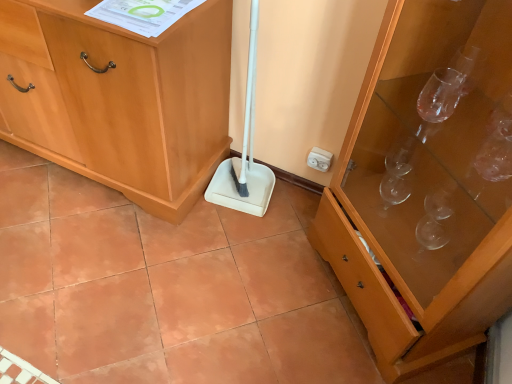
Question: Does light wood cabinet at center, placed as the 2th cabinetry when sorted from right to left, have a greater height compared to white plastic electric outlet at upper right?

Choices:
 (A) yes
 (B) no

Answer: (A)

Question: Considering the relative sizes of light wood cabinet at center, placed as the 2th cabinetry when sorted from right to left, and white plastic electric outlet at upper right in the image provided, is light wood cabinet at center, placed as the 2th cabinetry when sorted from right to left, thinner than white plastic electric outlet at upper right?

Choices:
 (A) no
 (B) yes

Answer: (A)

Question: Would you say light wood cabinet at center, placed as the 2th cabinetry when sorted from right to left, contains white plastic electric outlet at upper right?

Choices:
 (A) yes
 (B) no

Answer: (B)

Question: From the image's perspective, is light wood cabinet at center, placed as the 2th cabinetry when sorted from right to left, on top of white plastic electric outlet at upper right?

Choices:
 (A) yes
 (B) no

Answer: (A)

Question: Does light wood cabinet at center, placed as the first cabinetry when sorted from left to right, have a smaller size compared to white plastic electric outlet at upper right?

Choices:
 (A) no
 (B) yes

Answer: (A)

Question: Does light wood cabinet at center, placed as the 2th cabinetry when sorted from right to left, appear on the right side of white plastic electric outlet at upper right?

Choices:
 (A) no
 (B) yes

Answer: (A)

Question: Would you say terracotta ceramic tile at center is part of light wood cabinet at center, placed as the 2th cabinetry when sorted from right to left,'s contents?

Choices:
 (A) no
 (B) yes

Answer: (A)

Question: Considering the relative positions of light wood cabinet at center, placed as the 2th cabinetry when sorted from right to left, and terracotta ceramic tile at center in the image provided, is light wood cabinet at center, placed as the 2th cabinetry when sorted from right to left, to the right of terracotta ceramic tile at center from the viewer's perspective?

Choices:
 (A) yes
 (B) no

Answer: (B)

Question: Is light wood cabinet at center, placed as the first cabinetry when sorted from left to right, not inside terracotta ceramic tile at center?

Choices:
 (A) no
 (B) yes

Answer: (B)

Question: From a real-world perspective, is light wood cabinet at center, placed as the 2th cabinetry when sorted from right to left, positioned under terracotta ceramic tile at center based on gravity?

Choices:
 (A) yes
 (B) no

Answer: (B)

Question: Does light wood cabinet at center, placed as the first cabinetry when sorted from left to right, have a lesser width compared to terracotta ceramic tile at center?

Choices:
 (A) no
 (B) yes

Answer: (B)

Question: Can you confirm if light wood cabinet at center, placed as the first cabinetry when sorted from left to right, is wider than terracotta ceramic tile at center?

Choices:
 (A) yes
 (B) no

Answer: (B)

Question: Considering the relative sizes of light wood cabinet at center, placed as the 2th cabinetry when sorted from right to left, and transparent glass cabinet at right, acting as the first cabinetry starting from the right, in the image provided, is light wood cabinet at center, placed as the 2th cabinetry when sorted from right to left, smaller than transparent glass cabinet at right, acting as the first cabinetry starting from the right,?

Choices:
 (A) no
 (B) yes

Answer: (A)